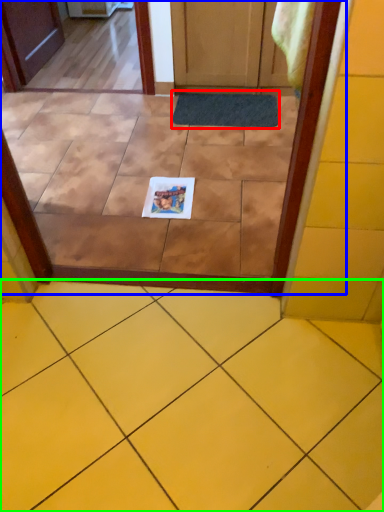
Question: Based on their relative distances, which object is farther from doormat (highlighted by a red box)? Choose from glass door (highlighted by a blue box) and ceramic tile (highlighted by a green box).

Choices:
 (A) glass door
 (B) ceramic tile

Answer: (B)